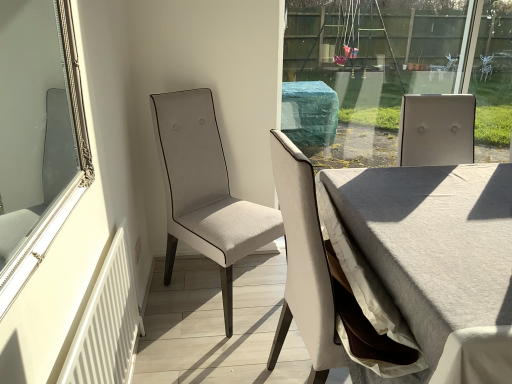
Question: Should I look upward or downward to see silver/golden mirror at left?

Choices:
 (A) down
 (B) up

Answer: (B)

Question: Is white fabric chair at center, the second chair from the front, far away from silver/golden mirror at left?

Choices:
 (A) no
 (B) yes

Answer: (A)

Question: Is white fabric chair at center, positioned as the first chair in back-to-front order, further to the viewer compared to silver/golden mirror at left?

Choices:
 (A) yes
 (B) no

Answer: (A)

Question: Is white fabric chair at center, positioned as the first chair in back-to-front order, to the left of silver/golden mirror at left from the viewer's perspective?

Choices:
 (A) yes
 (B) no

Answer: (B)

Question: Is white fabric chair at center, positioned as the first chair in back-to-front order, smaller than silver/golden mirror at left?

Choices:
 (A) yes
 (B) no

Answer: (B)

Question: Is white fabric chair at center, positioned as the first chair in back-to-front order, to the right of silver/golden mirror at left from the viewer's perspective?

Choices:
 (A) no
 (B) yes

Answer: (B)

Question: From the image's perspective, is white fabric chair at center, positioned as the first chair in back-to-front order, over silver/golden mirror at left?

Choices:
 (A) no
 (B) yes

Answer: (A)

Question: Is light beige fabric chair at center, which ranks as the 2th chair in back-to-front order, positioned behind white textured radiator at lower left?

Choices:
 (A) no
 (B) yes

Answer: (B)

Question: From a real-world perspective, is light beige fabric chair at center, which appears as the 1th chair when viewed from the front, physically below white textured radiator at lower left?

Choices:
 (A) no
 (B) yes

Answer: (A)

Question: Is light beige fabric chair at center, which ranks as the 2th chair in back-to-front order, at the left side of white textured radiator at lower left?

Choices:
 (A) yes
 (B) no

Answer: (B)

Question: Can you confirm if light beige fabric chair at center, which appears as the 1th chair when viewed from the front, is wider than white textured radiator at lower left?

Choices:
 (A) no
 (B) yes

Answer: (B)

Question: Does light beige fabric chair at center, which ranks as the 2th chair in back-to-front order, have a lesser width compared to white textured radiator at lower left?

Choices:
 (A) no
 (B) yes

Answer: (A)

Question: Does light beige fabric chair at center, which appears as the 1th chair when viewed from the front, have a greater height compared to white textured radiator at lower left?

Choices:
 (A) yes
 (B) no

Answer: (A)

Question: Is silver/golden mirror at left in front of white fabric chair at center, the second chair from the front?

Choices:
 (A) yes
 (B) no

Answer: (A)